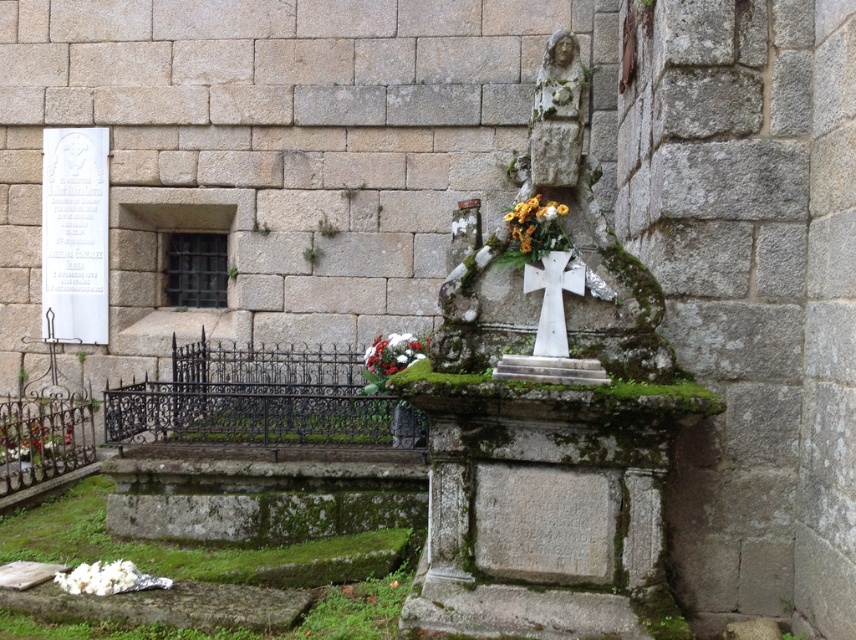
Question: Does white floral bouquet at lower left have a greater width compared to white fluffy petals at lower left?

Choices:
 (A) yes
 (B) no

Answer: (A)

Question: Does stone statue at center appear on the left side of white matte flowers at center?

Choices:
 (A) no
 (B) yes

Answer: (A)

Question: Does white stone cross at center appear over white floral bouquet at lower left?

Choices:
 (A) yes
 (B) no

Answer: (A)

Question: Among these objects, which one is farthest from the camera?

Choices:
 (A) stone statue at center
 (B) white floral bouquet at lower left
 (C) white matte flowers at center

Answer: (B)

Question: Which point is farther to the camera?

Choices:
 (A) (550, 205)
 (B) (381, 371)

Answer: (B)

Question: Among these points, which one is nearest to the camera?

Choices:
 (A) (415, 355)
 (B) (42, 449)

Answer: (A)